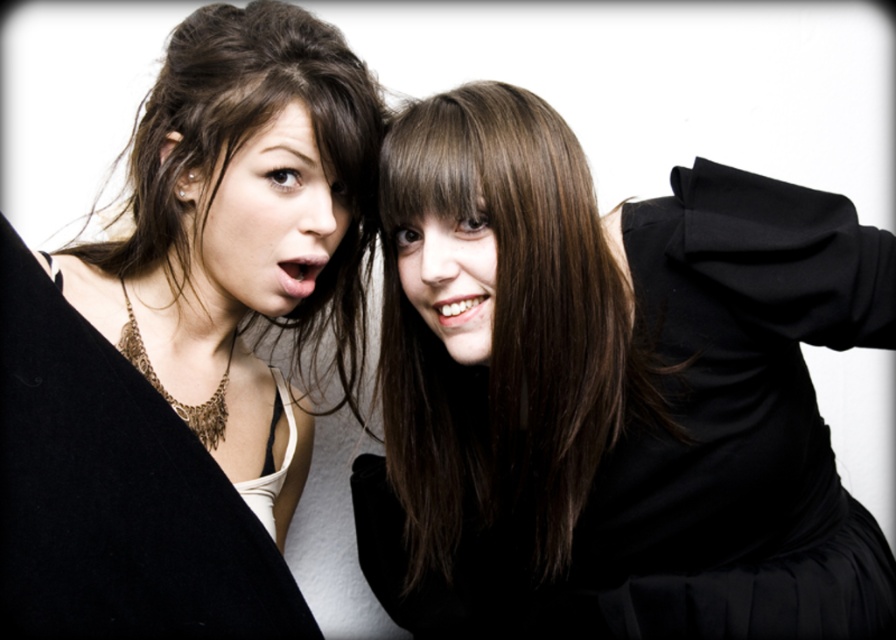
Question: Among these points, which one is farthest from the camera?

Choices:
 (A) 565,276
 (B) 435,284

Answer: (A)

Question: Which object appears closest to the camera in this image?

Choices:
 (A) black matte dress at center
 (B) smooth skin face at center

Answer: (B)

Question: Does black matte dress at center have a smaller size compared to smooth skin face at center?

Choices:
 (A) yes
 (B) no

Answer: (B)

Question: From the image, what is the correct spatial relationship of black matte dress at center in relation to smooth skin face at center?

Choices:
 (A) below
 (B) above

Answer: (A)

Question: Which point appears farthest from the camera in this image?

Choices:
 (A) (273, 166)
 (B) (222, 282)
 (C) (467, 330)

Answer: (B)

Question: Does black matte dress at center have a larger size compared to matte black coat at left?

Choices:
 (A) no
 (B) yes

Answer: (B)